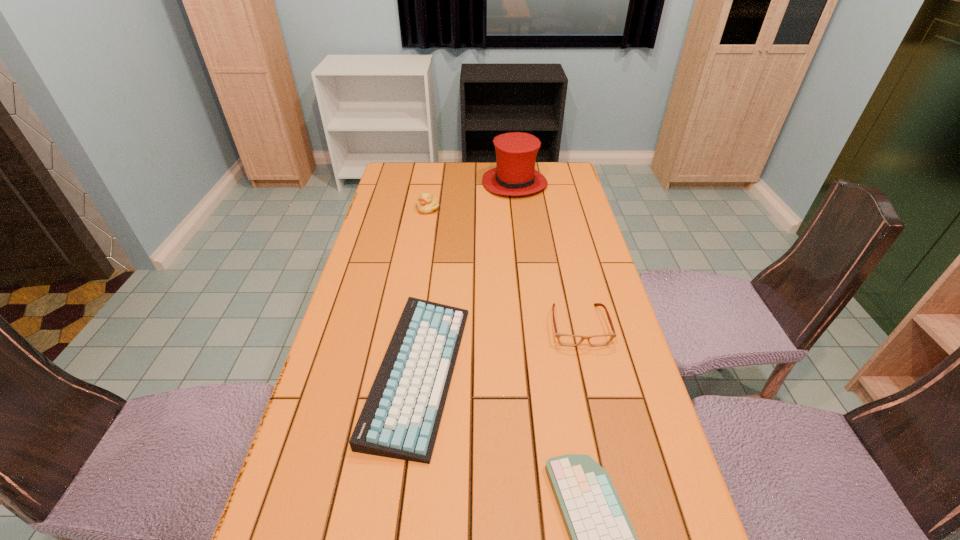
The image size is (960, 540). Identify the location of object positioned at the far edge. (515, 175).

Image resolution: width=960 pixels, height=540 pixels. What are the coordinates of `duckling at the left edge` in the screenshot? It's located at (427, 203).

Image resolution: width=960 pixels, height=540 pixels. Identify the location of computer keyboard located at the left edge. (400, 419).

Find the location of a particular element. This screenshot has width=960, height=540. hat positioned at the right edge is located at coordinates (515, 175).

Find the location of a particular element. The image size is (960, 540). spectacles that is at the right edge is located at coordinates (564, 339).

In order to click on object that is positioned at the far right corner in this screenshot , I will do `click(515, 175)`.

The height and width of the screenshot is (540, 960). What are the coordinates of `free space at the left edge` in the screenshot? It's located at (386, 335).

The image size is (960, 540). In the image, there is a desktop. What are the coordinates of `vacant space at the right edge` in the screenshot? It's located at (570, 243).

Find the location of a particular element. blank space at the far left corner of the desktop is located at coordinates (419, 185).

Find the location of `vacant area that lies between the farthest object and the left computer keyboard`. vacant area that lies between the farthest object and the left computer keyboard is located at coordinates (467, 278).